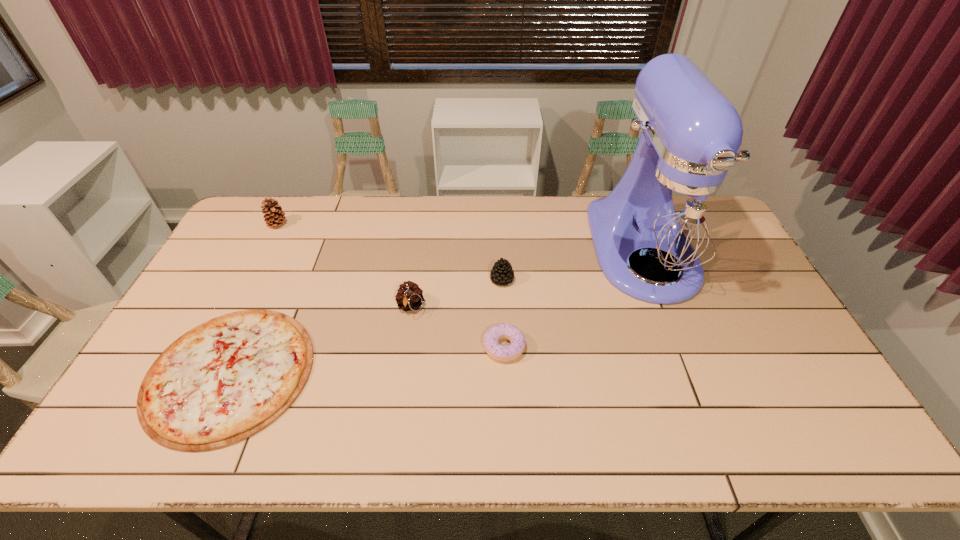
The width and height of the screenshot is (960, 540). In the image, there is a desktop. Find the location of `free space at the near right corner`. free space at the near right corner is located at coordinates (827, 448).

This screenshot has height=540, width=960. Find the location of `free area in between the rightmost pinecone and the leftmost pinecone`. free area in between the rightmost pinecone and the leftmost pinecone is located at coordinates (390, 252).

Locate an element on the screen. The image size is (960, 540). free space between the tallest pinecone and the nearest pinecone is located at coordinates (344, 266).

Where is `unoccupied position between the pizza and the rightmost pinecone`? The height and width of the screenshot is (540, 960). unoccupied position between the pizza and the rightmost pinecone is located at coordinates (366, 326).

Find the location of `free space between the second shortest object and the tallest object`. free space between the second shortest object and the tallest object is located at coordinates pyautogui.click(x=574, y=299).

What are the coordinates of `free area in between the second pinecone from left to right and the pizza` in the screenshot? It's located at (321, 340).

This screenshot has width=960, height=540. I want to click on free space that is in between the second farthest pinecone and the second pinecone from left to right, so click(x=456, y=293).

At what (x,y) coordinates should I click in order to perform the action: click on empty space between the doughnut and the rightmost pinecone. Please return your answer as a coordinate pair (x, y). This screenshot has height=540, width=960. Looking at the image, I should click on (503, 313).

Where is `vacant point located between the rightmost pinecone and the fifth shortest object`? The image size is (960, 540). vacant point located between the rightmost pinecone and the fifth shortest object is located at coordinates (390, 252).

Locate an element on the screen. free space between the pizza and the tallest object is located at coordinates (437, 312).